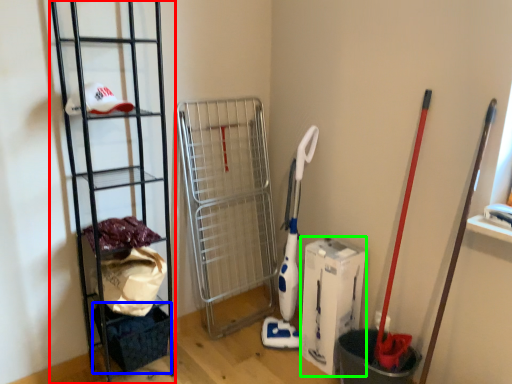
Question: Which object is positioned farthest from ladder (highlighted by a red box)? Select from basket (highlighted by a blue box) and box (highlighted by a green box).

Choices:
 (A) basket
 (B) box

Answer: (B)